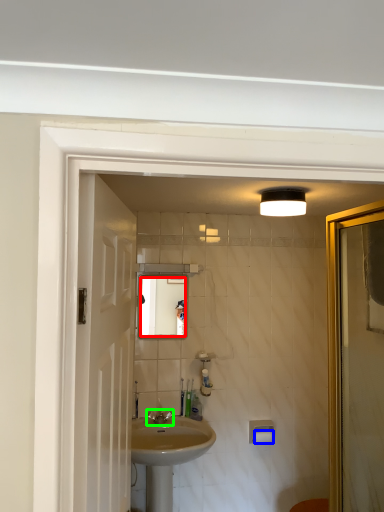
Question: Which object is the farthest from mirror (highlighted by a red box)? Choose among these: toilet paper (highlighted by a blue box) or tap (highlighted by a green box).

Choices:
 (A) toilet paper
 (B) tap

Answer: (A)